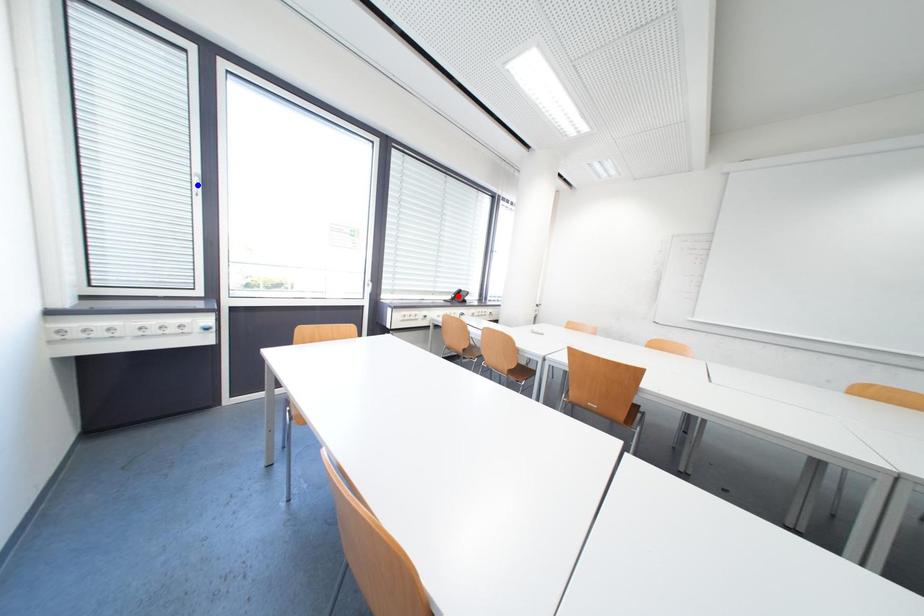
Question: In the image, two points are highlighted. Which point is nearer to the camera? Reply with the corresponding letter.

Choices:
 (A) blue point
 (B) red point

Answer: (A)